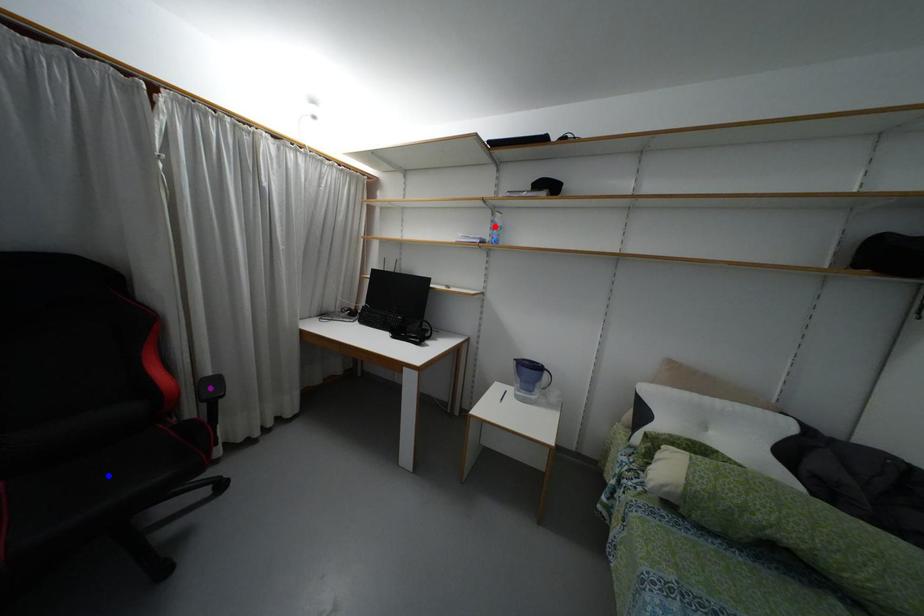
Order these from nearest to farthest:
blue point
purple point
red point

1. blue point
2. purple point
3. red point